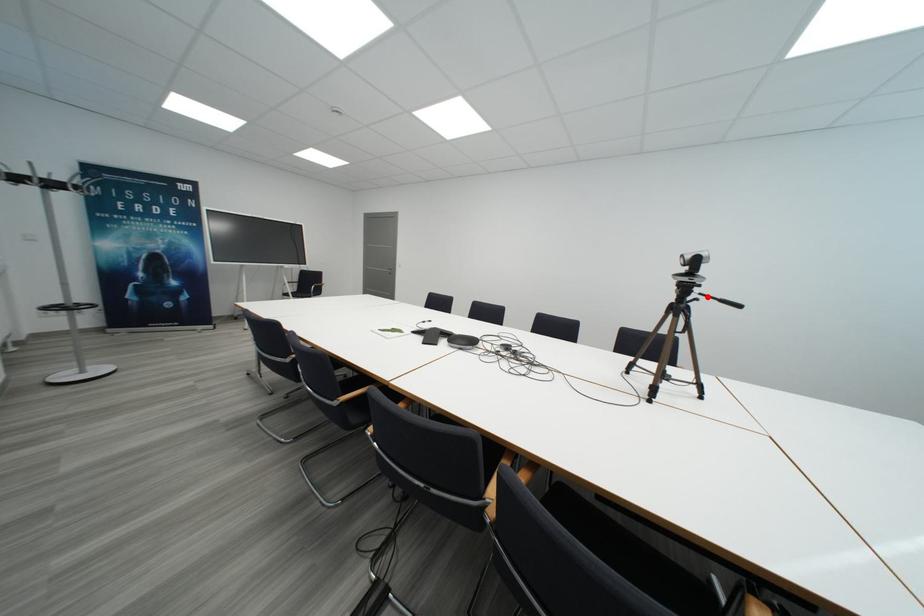
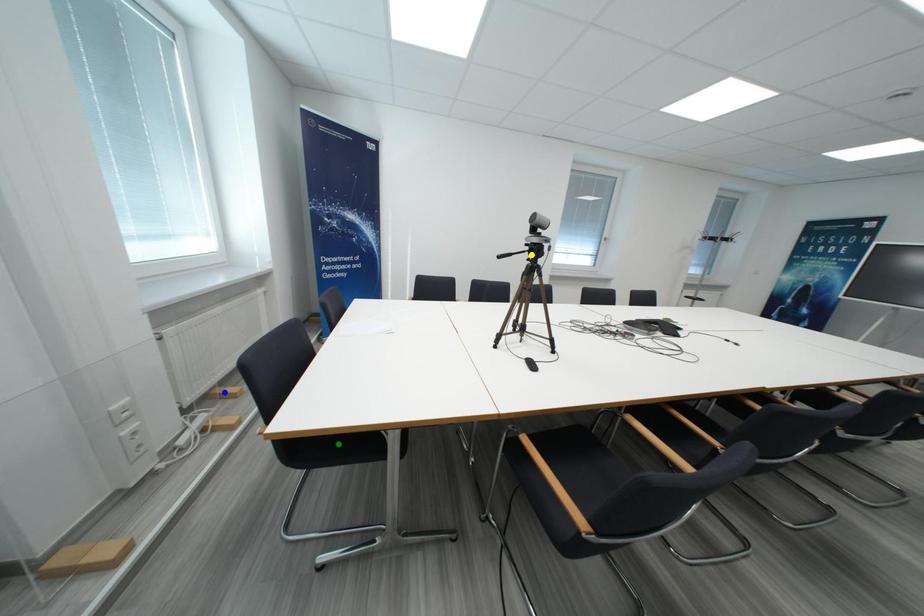
Question: I am providing you with two images of the same scene from different viewpoints. A red point is marked on the first image. You are given multiple points on the second image. Which mark in image 2 goes with the point in image 1?

Choices:
 (A) green point
 (B) blue point
 (C) yellow point

Answer: (C)